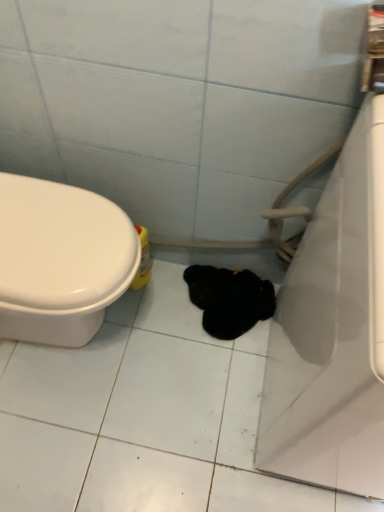
Find the location of a particular element. The image size is (384, 512). vacant space that's between yellow plastic bottle at lower left and black fuzzy animal at center is located at coordinates (167, 291).